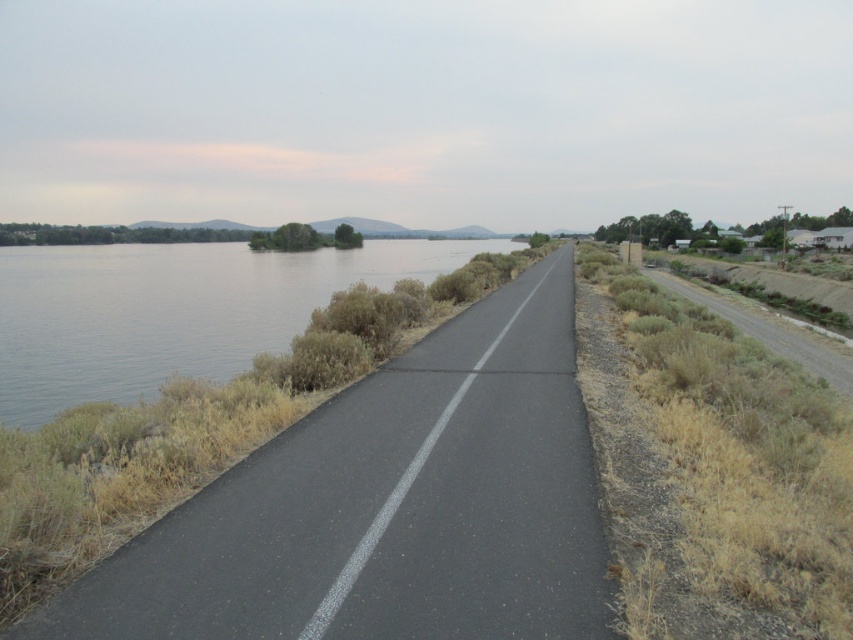
Can you confirm if clear water at left is positioned above dry grass at right?

Yes.

How distant is clear water at left from dry grass at right?

clear water at left is 152.65 feet away from dry grass at right.

Where is `clear water at left`? The width and height of the screenshot is (853, 640). clear water at left is located at coordinates (172, 310).

Find the location of a particular element. black asphalt road at center is located at coordinates (387, 506).

Image resolution: width=853 pixels, height=640 pixels. Describe the element at coordinates (387, 506) in the screenshot. I see `black asphalt road at center` at that location.

Image resolution: width=853 pixels, height=640 pixels. I want to click on black asphalt road at center, so coord(387,506).

Which is above, black asphalt road at center or dry grass at right?

dry grass at right is higher up.

Does black asphalt road at center have a lesser height compared to dry grass at right?

Correct, black asphalt road at center is not as tall as dry grass at right.

Is point (340, 579) closer to camera compared to point (813, 358)?

Yes, point (340, 579) is closer to viewer.

The height and width of the screenshot is (640, 853). What are the coordinates of `black asphalt road at center` in the screenshot? It's located at (387, 506).